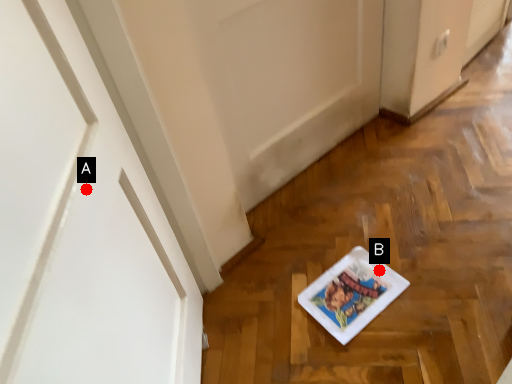
Question: Two points are circled on the image, labeled by A and B beside each circle. Which point appears closest to the camera in this image?

Choices:
 (A) A is closer
 (B) B is closer

Answer: (A)